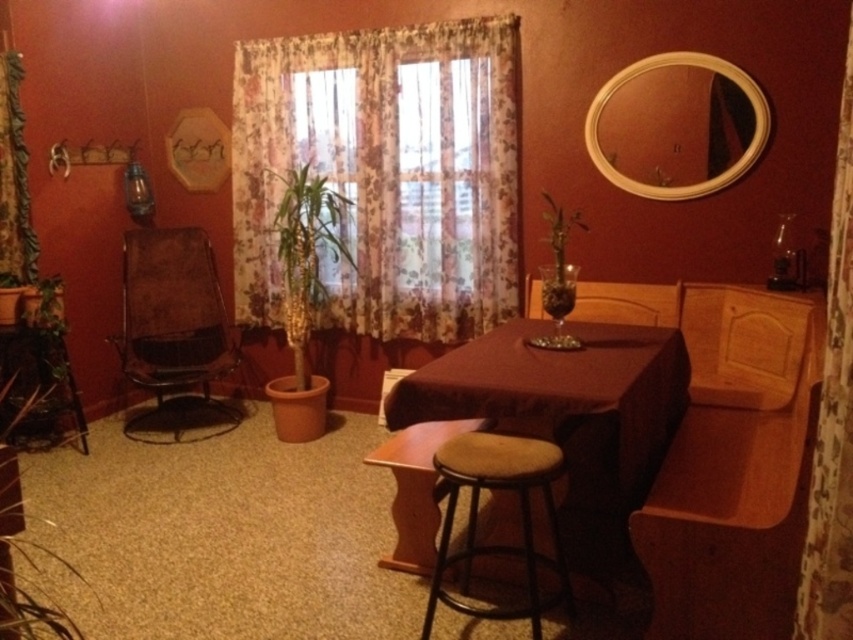
Question: Is floral sheer curtains at center bigger than floral fabric curtain at right?

Choices:
 (A) no
 (B) yes

Answer: (B)

Question: Among these objects, which one is nearest to the camera?

Choices:
 (A) green leafy plant in glass vase at center
 (B) light brown wood bench at lower right
 (C) floral fabric curtain at left
 (D) floral fabric curtain at right

Answer: (D)

Question: Which point is farther from the camera taking this photo?

Choices:
 (A) 534,451
 (B) 285,300

Answer: (B)

Question: Can you confirm if brown fabric chair at left is wider than brown fabric stool at lower center?

Choices:
 (A) no
 (B) yes

Answer: (B)

Question: Estimate the real-world distances between objects in this image. Which object is closer to the floral sheer curtains at center?

Choices:
 (A) green leafy plant in glass vase at center
 (B) brown fabric stool at lower center
 (C) floral fabric curtain at left
 (D) brown fabric table at center

Answer: (A)

Question: Does brown fabric chair at left have a lesser width compared to green leafy plant in glass vase at center?

Choices:
 (A) no
 (B) yes

Answer: (A)